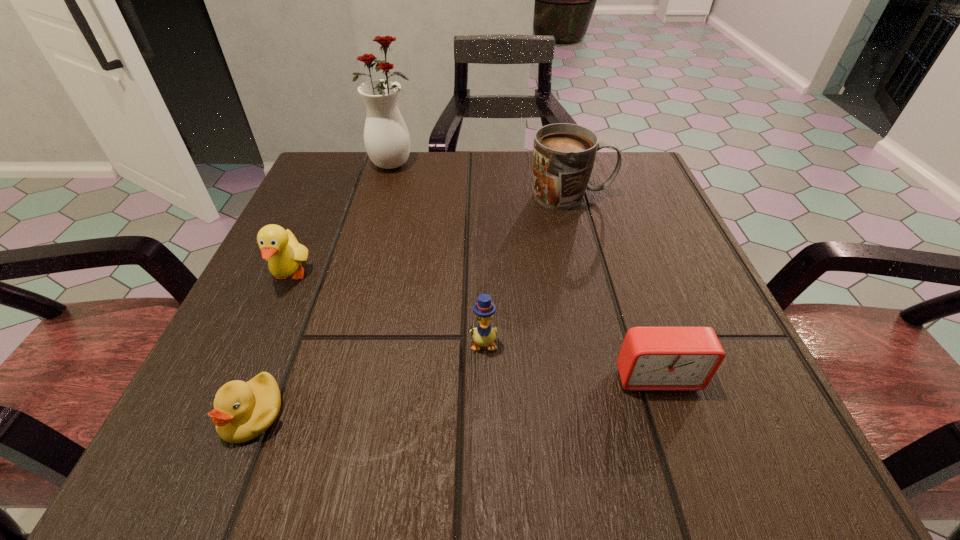
At what (x,y) coordinates should I click in order to perform the action: click on the farthest object. Please return your answer as a coordinate pair (x, y). The image size is (960, 540). Looking at the image, I should click on (386, 137).

This screenshot has width=960, height=540. I want to click on vase, so click(x=386, y=137).

Where is `mug`? The width and height of the screenshot is (960, 540). mug is located at coordinates (564, 154).

Locate an element on the screen. The height and width of the screenshot is (540, 960). the second tallest object is located at coordinates (564, 154).

You are a GUI agent. You are given a task and a screenshot of the screen. Output one action in this format:
    pyautogui.click(x=<x>, y=<y>)
    Task: Click on the farthest duckling
    
    Given the screenshot: What is the action you would take?
    pyautogui.click(x=280, y=247)

The height and width of the screenshot is (540, 960). Find the location of `the second nearest duckling`. the second nearest duckling is located at coordinates (484, 335).

This screenshot has width=960, height=540. Find the location of `the fourth farthest object`. the fourth farthest object is located at coordinates (484, 335).

The height and width of the screenshot is (540, 960). Identify the location of alarm clock. (651, 358).

Identify the location of the shortest object. The width and height of the screenshot is (960, 540). pyautogui.click(x=242, y=411).

This screenshot has width=960, height=540. In order to click on the nearest duckling in this screenshot , I will do `click(242, 411)`.